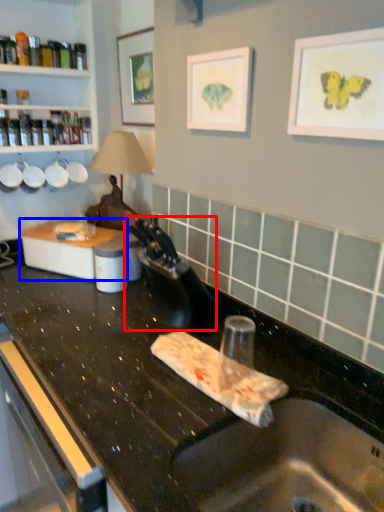
Question: Which point is further to the camera, faucet (highlighted by a red box) or appliance (highlighted by a blue box)?

Choices:
 (A) faucet
 (B) appliance

Answer: (B)